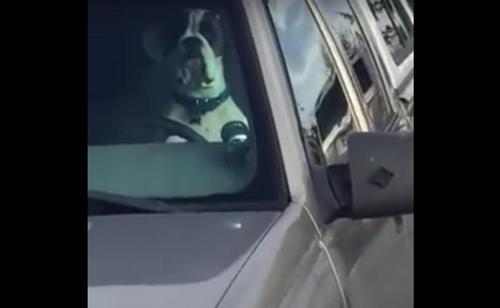
Identify the location of handle door. The height and width of the screenshot is (308, 500). (388, 225).